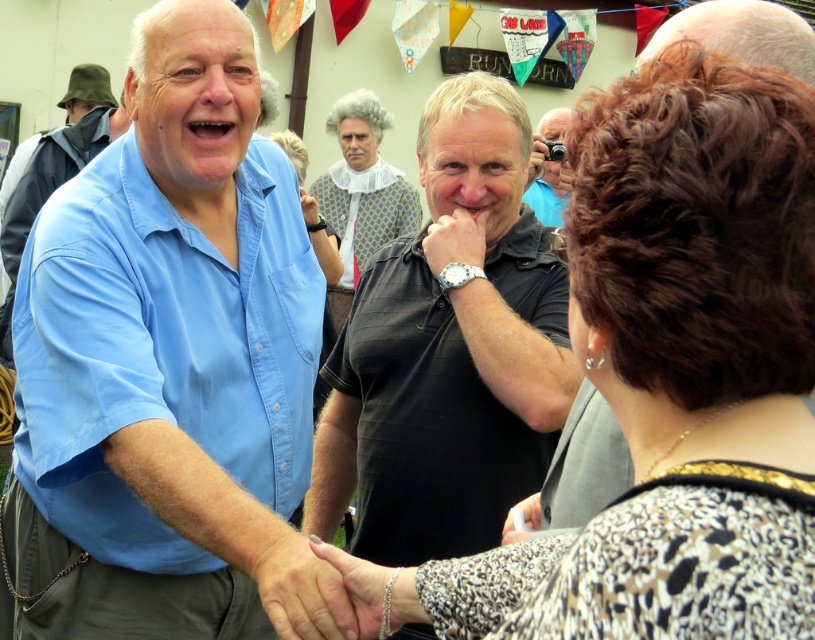
Between black smooth shirt at center and white lace collar at center, which one is positioned lower?

black smooth shirt at center

Is point (501, 276) less distant than point (373, 148)?

Yes, point (501, 276) is closer to viewer.

Identify the location of black smooth shirt at center. The image size is (815, 640). (448, 349).

Who is taller, leopard print blouse at center or black smooth shirt at center?

black smooth shirt at center

Who is positioned more to the right, leopard print blouse at center or black smooth shirt at center?

Positioned to the right is leopard print blouse at center.

Between point (570, 276) and point (443, 321), which one is positioned behind?

Positioned behind is point (443, 321).

Locate an element on the screen. This screenshot has width=815, height=640. leopard print blouse at center is located at coordinates (670, 376).

Is point (676, 221) positioned before point (554, 173)?

Yes, it is.

Does leopard print blouse at center appear on the right side of matte black camera at upper center?

In fact, leopard print blouse at center is to the left of matte black camera at upper center.

Where is `leopard print blouse at center`? This screenshot has width=815, height=640. leopard print blouse at center is located at coordinates (670, 376).